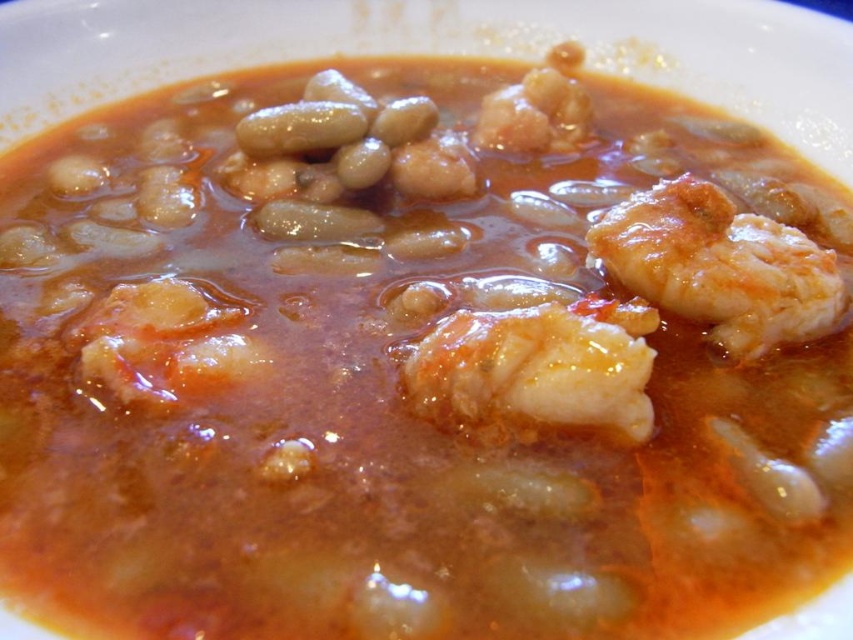
Question: Is translucent gelatinous shrimp at center behind white glossy shrimp at right?

Choices:
 (A) no
 (B) yes

Answer: (A)

Question: Is translucent gelatinous shrimp at center smaller than white glossy shrimp at right?

Choices:
 (A) yes
 (B) no

Answer: (A)

Question: Which object appears farthest from the camera in this image?

Choices:
 (A) translucent gelatinous shrimp at center
 (B) white glossy shrimp at right

Answer: (B)

Question: Which object appears farthest from the camera in this image?

Choices:
 (A) translucent gelatinous shrimp at center
 (B) white glossy shrimp at right

Answer: (B)

Question: Does translucent gelatinous shrimp at center have a smaller size compared to white glossy shrimp at right?

Choices:
 (A) no
 (B) yes

Answer: (B)